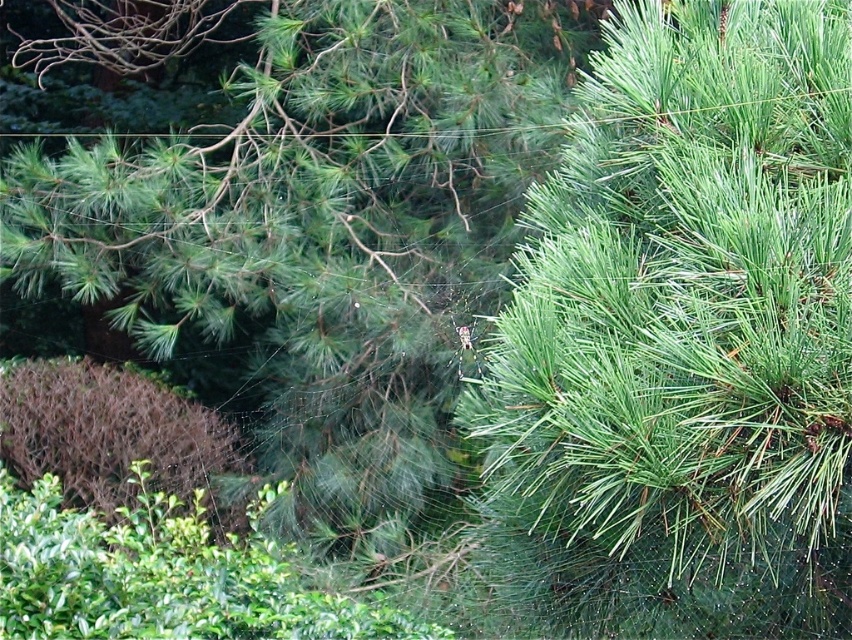
Question: Which object is positioned farthest from the brown textured bush at lower left?

Choices:
 (A) green needle-like at center
 (B) green leafy bush at lower left

Answer: (B)

Question: Which point appears closest to the camera in this image?

Choices:
 (A) (269, 145)
 (B) (222, 420)

Answer: (A)

Question: Does green needle-like at center appear under green leafy bush at lower left?

Choices:
 (A) yes
 (B) no

Answer: (B)

Question: Which point is farther to the camera?

Choices:
 (A) green needle-like at center
 (B) green leafy bush at lower left

Answer: (A)

Question: Is green needle-like at center to the right of brown textured bush at lower left from the viewer's perspective?

Choices:
 (A) no
 (B) yes

Answer: (B)

Question: Can you confirm if green leafy bush at lower left is smaller than brown textured bush at lower left?

Choices:
 (A) no
 (B) yes

Answer: (B)